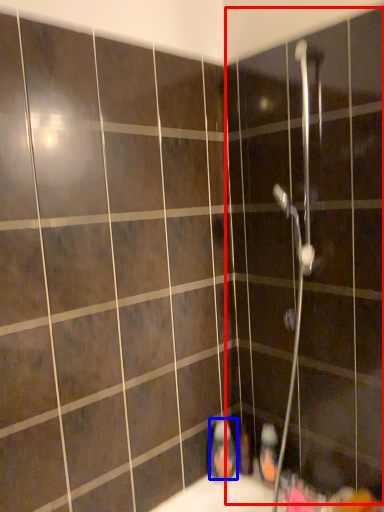
Question: Which point is further to the camera, screen door (highlighted by a red box) or toiletry (highlighted by a blue box)?

Choices:
 (A) screen door
 (B) toiletry

Answer: (B)